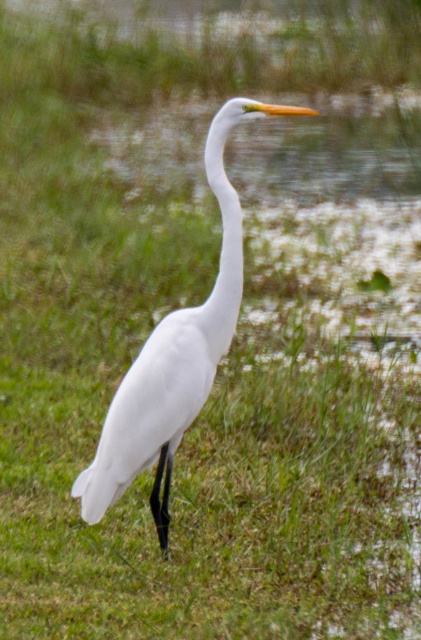
Question: Which of the following is the closest to the observer?

Choices:
 (A) white smooth neck at center
 (B) white matte bird at center

Answer: (A)

Question: Can you confirm if white matte bird at center is smaller than white smooth neck at center?

Choices:
 (A) yes
 (B) no

Answer: (B)

Question: Is white matte bird at center wider than white smooth neck at center?

Choices:
 (A) no
 (B) yes

Answer: (B)

Question: Among these objects, which one is nearest to the camera?

Choices:
 (A) white matte bird at center
 (B) white smooth neck at center

Answer: (B)

Question: Which object appears farthest from the camera in this image?

Choices:
 (A) white smooth neck at center
 (B) white matte bird at center

Answer: (B)

Question: Is white matte bird at center to the left of white smooth neck at center from the viewer's perspective?

Choices:
 (A) yes
 (B) no

Answer: (A)